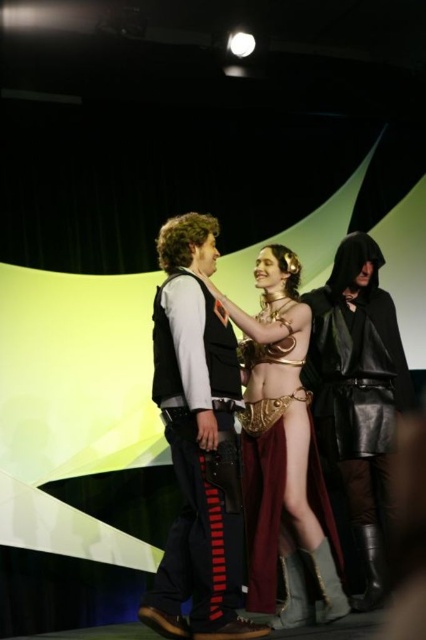
Who is higher up, velvet black vest at center or black leather cloak at right?

velvet black vest at center

Is point (198, 280) positioned before point (319, 324)?

Yes, point (198, 280) is in front of point (319, 324).

Does point (176, 568) lie behind point (382, 417)?

No, it is in front of (382, 417).

Identify the location of velvet black vest at center. (198, 442).

Between gold metallic armor at center and black leather cloak at right, which one is positioned lower?

gold metallic armor at center

Does gold metallic armor at center have a lesser height compared to black leather cloak at right?

Correct, gold metallic armor at center is not as tall as black leather cloak at right.

Does point (327, 508) come behind point (377, 248)?

No, (327, 508) is closer to viewer.

At what (x,y) coordinates should I click in order to perform the action: click on gold metallic armor at center. Please return your answer as a coordinate pair (x, y). The height and width of the screenshot is (640, 426). Looking at the image, I should click on (282, 452).

Which is above, velvet black vest at center or gold metallic armor at center?

Positioned higher is velvet black vest at center.

What do you see at coordinates (198, 442) in the screenshot?
I see `velvet black vest at center` at bounding box center [198, 442].

What are the coordinates of `velvet black vest at center` in the screenshot? It's located at (198, 442).